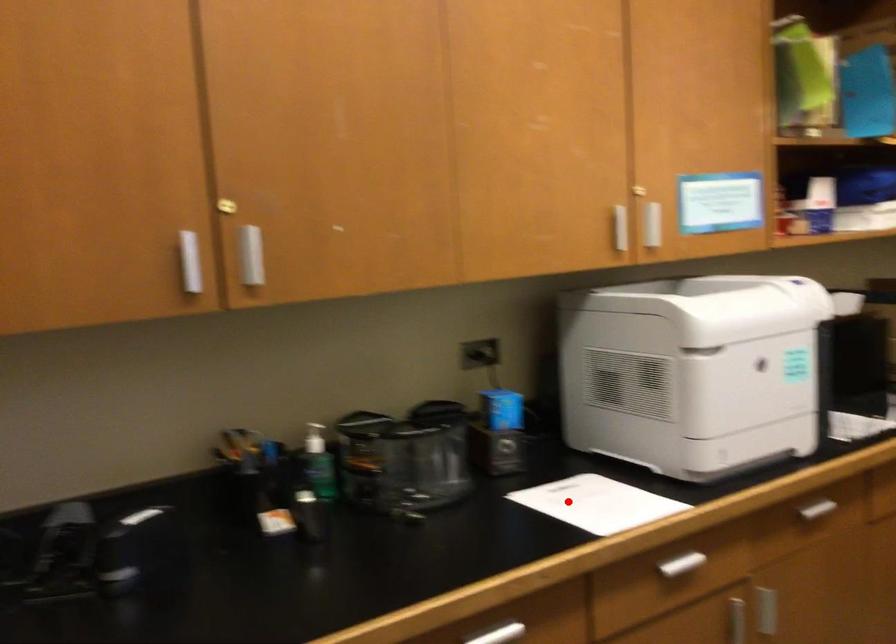
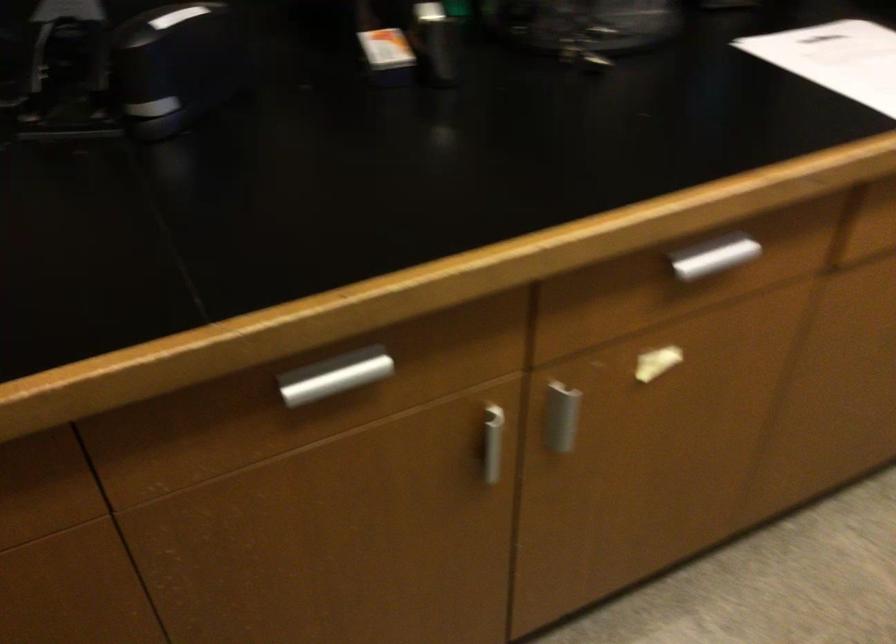
Question: I am providing you with two images of the same scene from different viewpoints. A red point is marked on the first image. At the location where the point appears in image 1, is it still visible in image 2?

Choices:
 (A) Yes
 (B) No

Answer: (A)